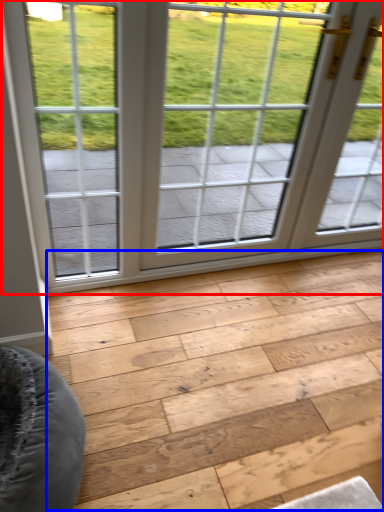
Question: Among these objects, which one is farthest to the camera, window (highlighted by a red box) or plank (highlighted by a blue box)?

Choices:
 (A) window
 (B) plank

Answer: (A)